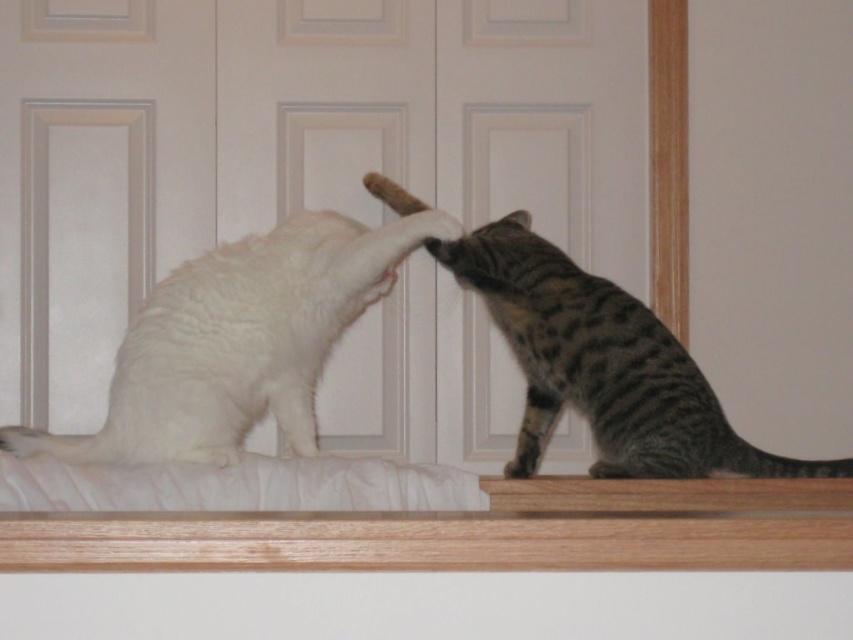
You are a cat owner trying to place two cat beds on the wooden surface where the white fluffy cat at left and the gray striped cat at upper right are playing. Given their sizes, which cat bed should be larger to accommodate the cat with more width?

The gray striped cat at upper right has a greater width than the white fluffy cat at left, so the cat bed for the gray striped cat at upper right should be larger to accommodate its size.